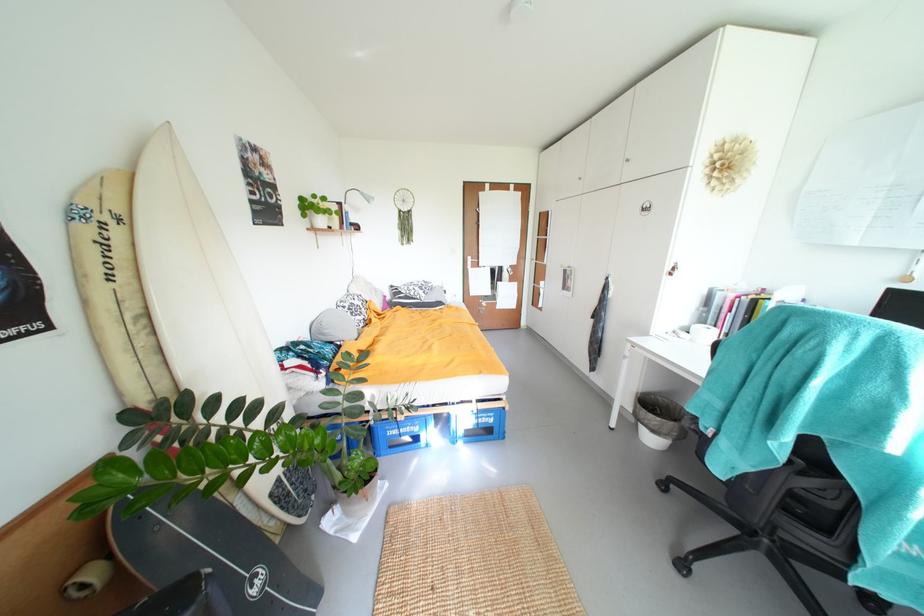
Where would you adjust the lamp head? Please return your answer as a coordinate pair (x, y).

(358, 195)